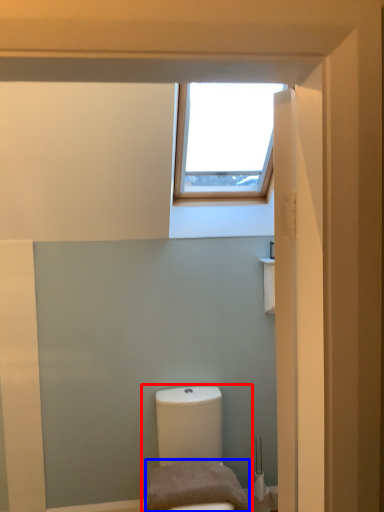
Question: Which point is closer to the camera, toilet (highlighted by a red box) or pillow (highlighted by a blue box)?

Choices:
 (A) toilet
 (B) pillow

Answer: (A)